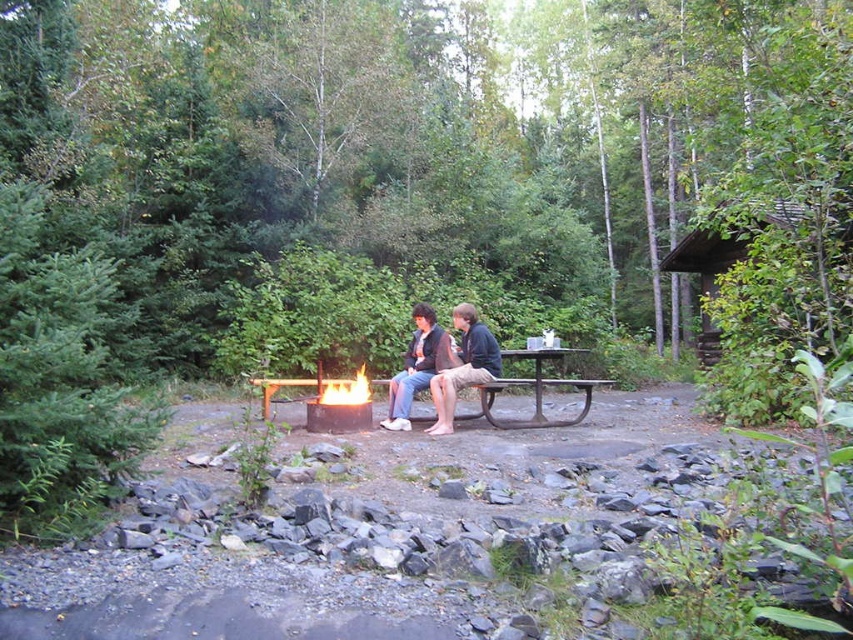
You are planning to take a photo of the brown wooden cabin at upper right from the picnic table. Based on its position, is the cabin located to the left or right side of the image?

The brown wooden cabin at upper right is located at the right side of the image because its x coordinate is 0.400, which is closer to the right edge of the image.